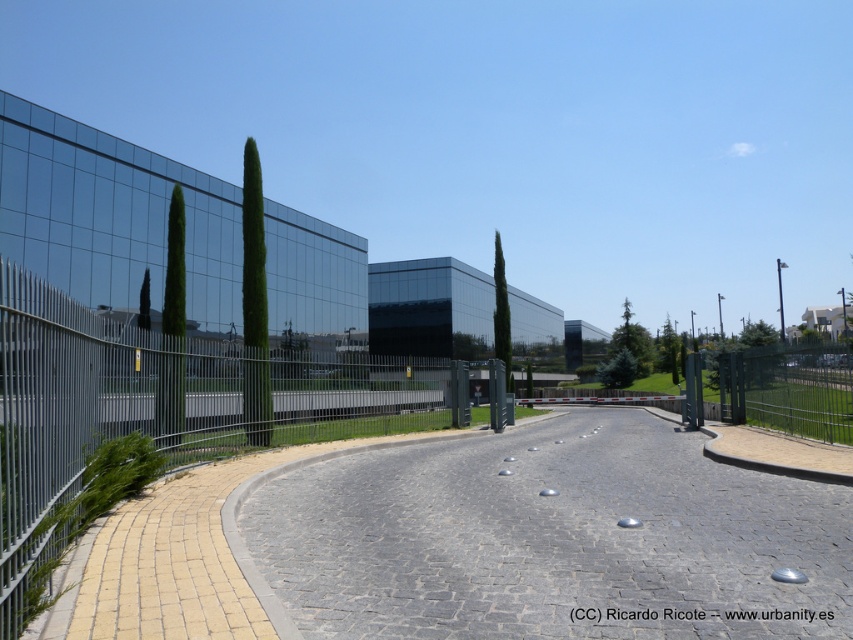
Question: Does gray cobblestone pavement at center appear on the right side of black metal fence at right?

Choices:
 (A) yes
 (B) no

Answer: (B)

Question: Which point is farther from the camera taking this photo?

Choices:
 (A) (740, 358)
 (B) (163, 298)
 (C) (508, 380)
 (D) (389, 548)

Answer: (B)

Question: Which point is closer to the camera?

Choices:
 (A) black metal fence at right
 (B) gray cobblestone pavement at center
 (C) green glossy cypress at left

Answer: (B)

Question: Which point is closer to the camera?

Choices:
 (A) green glossy cypress tree at center
 (B) gray cobblestone pavement at center

Answer: (B)

Question: Does green glossy cypress tree at left appear on the right side of green glossy cypress tree at center?

Choices:
 (A) no
 (B) yes

Answer: (A)

Question: Can you confirm if gray cobblestone pavement at center is thinner than metallic wire mesh at left?

Choices:
 (A) yes
 (B) no

Answer: (A)